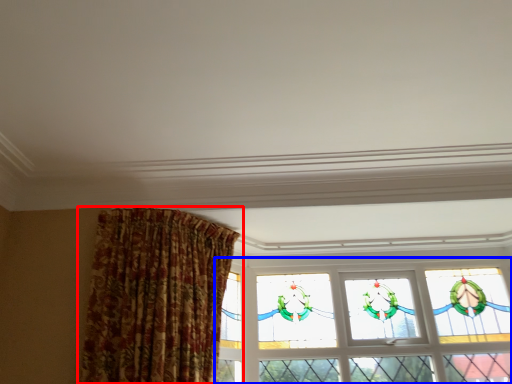
Question: Which point is closer to the camera, curtain (highlighted by a red box) or window (highlighted by a blue box)?

Choices:
 (A) curtain
 (B) window

Answer: (A)